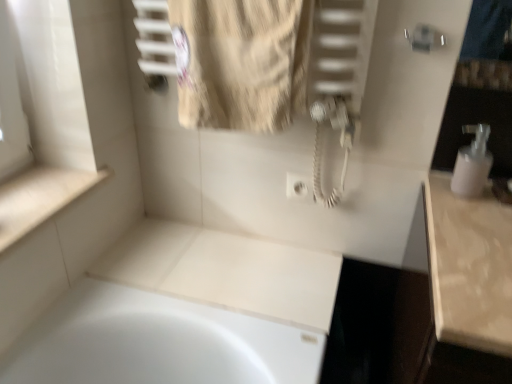
Identify the location of vacant area on top of white glossy counter top at lower left (from a real-world perspective). (38, 187).